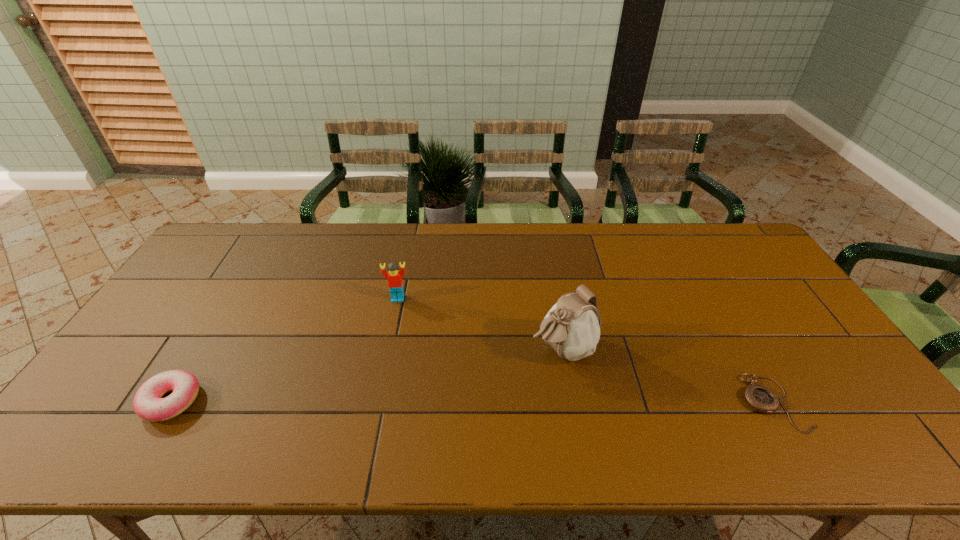
Where is `free spot between the third tallest object and the farthest object`? free spot between the third tallest object and the farthest object is located at coordinates pyautogui.click(x=284, y=350).

Locate an element on the screen. free space between the Lego and the doughnut is located at coordinates (284, 350).

Locate an element on the screen. The width and height of the screenshot is (960, 540). free space between the third object from left to right and the leftmost object is located at coordinates (367, 375).

I want to click on free area in between the tallest object and the Lego, so click(480, 323).

Where is `the closest object relative to the pocket watch`? The height and width of the screenshot is (540, 960). the closest object relative to the pocket watch is located at coordinates (572, 327).

Where is `object identified as the second closest to the second shortest object`? This screenshot has height=540, width=960. object identified as the second closest to the second shortest object is located at coordinates (572, 327).

Identify the location of free space that satisfies the following two spatial constraints: 1. on the front side of the second tallest object; 2. on the right side of the third object from left to right. This screenshot has height=540, width=960. (388, 349).